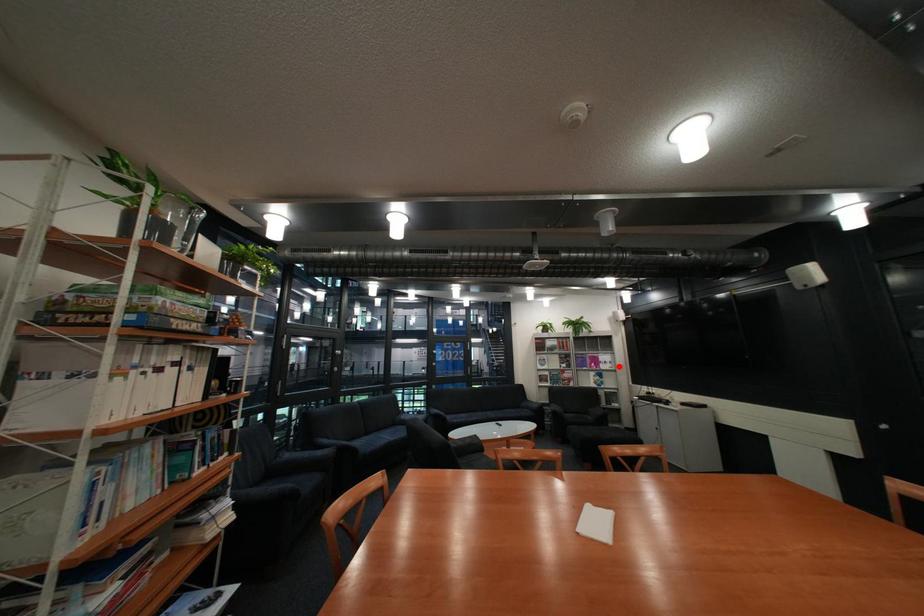
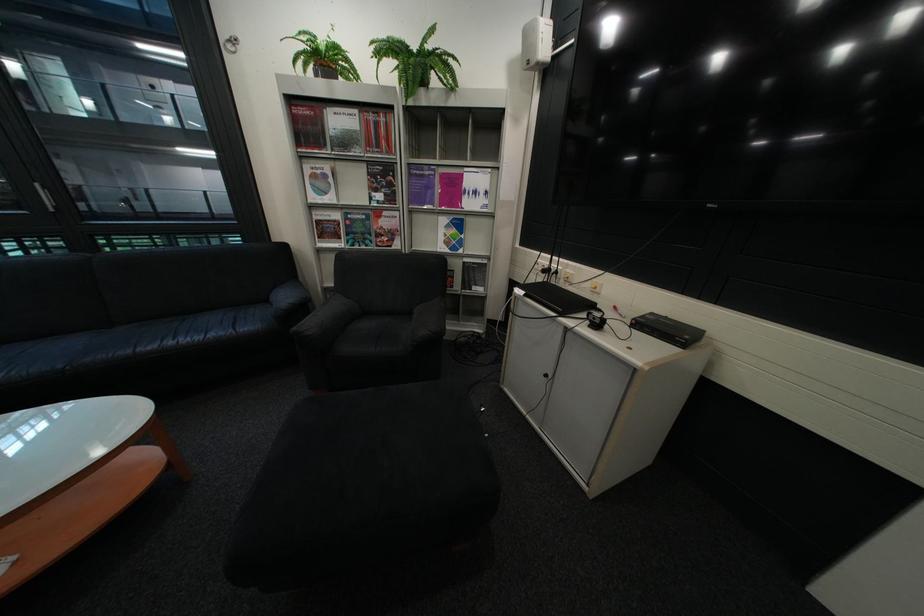
Question: I am providing you with two images of the same scene from different viewpoints. A red point is shown in image1. For the corresponding object point in image2, is it positioned nearer or farther from the camera?

Choices:
 (A) Nearer
 (B) Farther

Answer: (A)